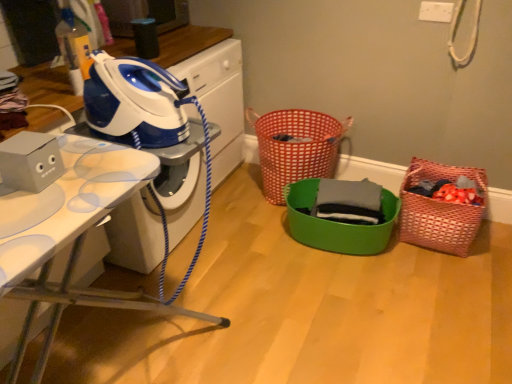
You are a GUI agent. You are given a task and a screenshot of the screen. Output one action in this format:
    pyautogui.click(x=<x>, y=<y>)
    Task: Click on the free location in front of green plastic basket at center, marked as the 2th basket in a left-to-right arrangement
    
    Given the screenshot: What is the action you would take?
    pyautogui.click(x=348, y=300)